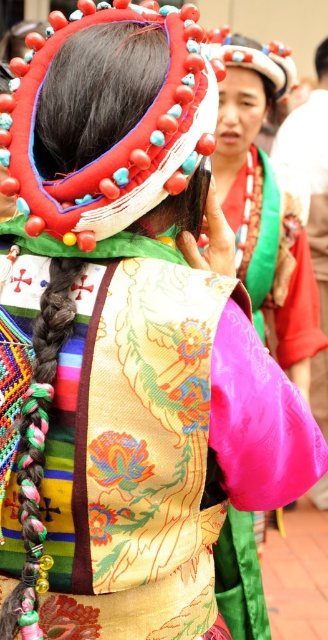
You are a photographer planning to take a portrait of the person wearing the matte red headdress at center and the matte black hair at upper center. To ensure both elements are clearly visible in the photo, which one should you focus on first, considering their heights?

The matte red headdress at center is taller than the matte black hair at upper center, so you should focus on the matte red headdress at center first to ensure its details are captured clearly.

You are taking a photo of the headdress and the braid. You want to focus on the part of the headdress that is closer to the camera. Which point should you focus on, point (x=253, y=42) or point (x=321, y=72)?

Point (x=253, y=42) is closer to the camera than point (x=321, y=72), so you should focus on point (x=253, y=42) to capture the part of the headdress that is closer.

Looking at this image, you are a photographer planning to capture the vibrant details of the silky pink fabric at center and the matte red headdress at center. Based on their sizes, which object should you focus on first to ensure it fits within your camera frame?

The silky pink fabric at center has a larger size compared to the matte red headdress at center, so you should focus on the silky pink fabric at center first to ensure it fits within your camera frame.